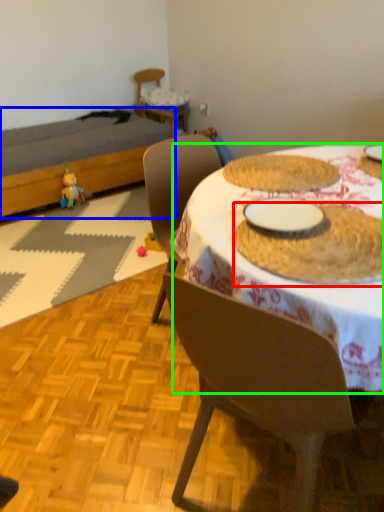
Question: Which is nearer to the food (highlighted by a red box)? bed (highlighted by a blue box) or desk (highlighted by a green box).

Choices:
 (A) bed
 (B) desk

Answer: (B)